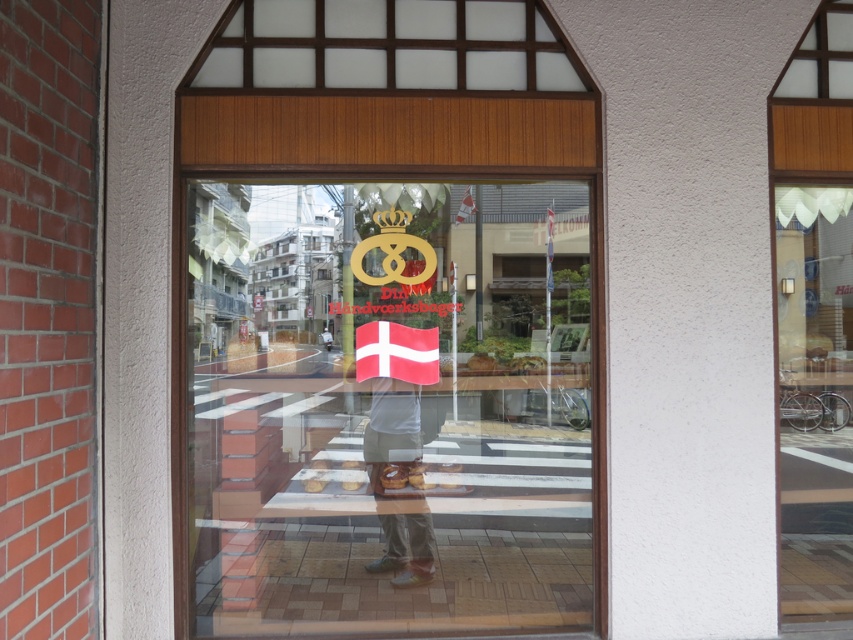
You are standing outside the bakery looking through the window. There are two points marked on the window. The first point is at coordinate [543,467] and the second point is at coordinate [824,365]. Which point is closer to you as you look through the window?

Point [543,467] is in front of point [824,365], so the first point is closer to you.

You are a customer trying to enter the bakery through the transparent glass door at center. You are wearing denim pants at center. Can your pants fit through the door without any adjustments?

The transparent glass door at center has a larger width than the denim pants at center, so the denim pants at center can fit through the door without any adjustments.

You are standing outside the bakery looking through the window. You notice two points marked on the window glass. Which point is closer to you, point at coordinate [358,545] or point at coordinate [384,566]?

Point at coordinate [358,545] is closer to you because it is further to the viewer than point at coordinate [384,566].